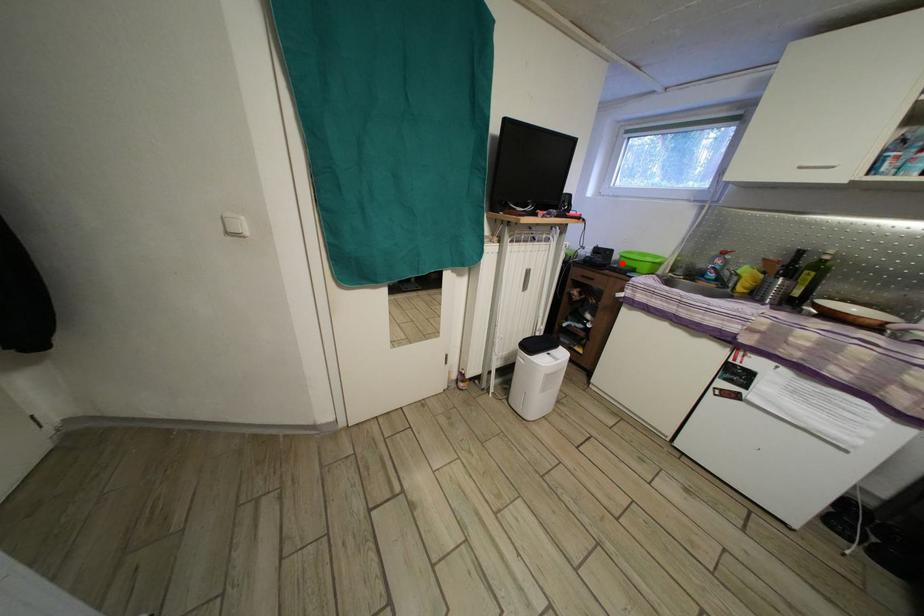
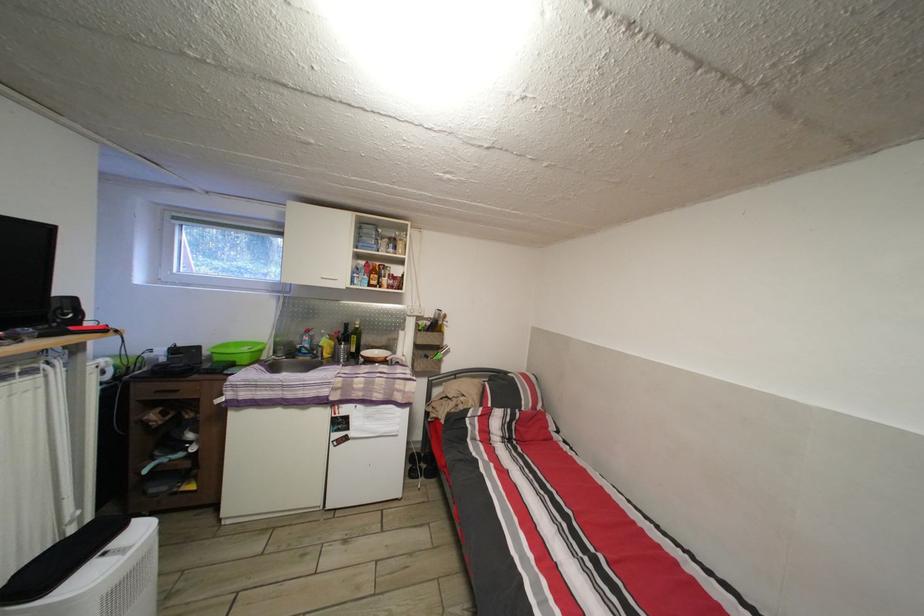
Question: I am providing you with two images of the same scene from different viewpoints. A red point is shown in image1. For the corresponding object point in image2, is it positioned nearer or farther from the camera?

Choices:
 (A) Nearer
 (B) Farther

Answer: (B)